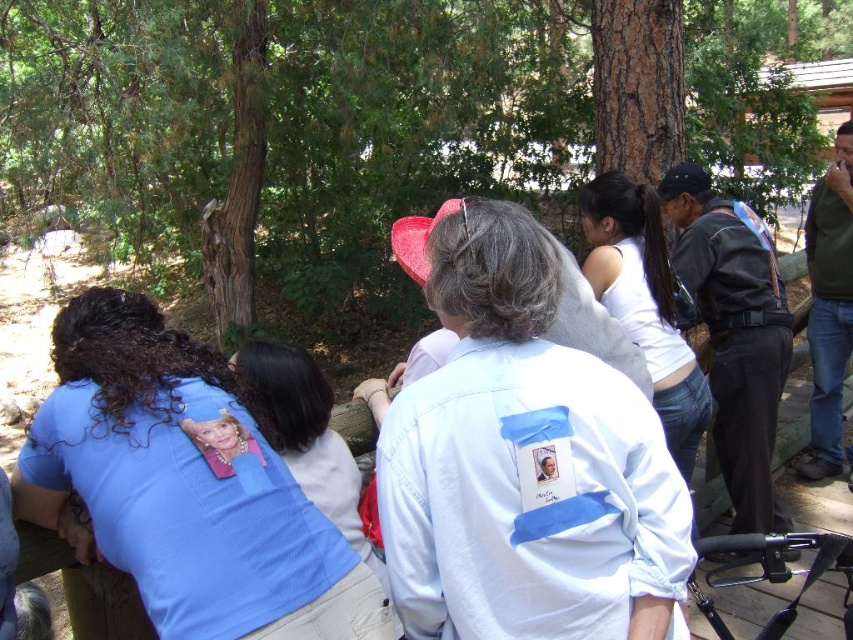
Question: From the image, what is the correct spatial relationship of brown rough tree at center in relation to white cotton tank top at upper right?

Choices:
 (A) left
 (B) right

Answer: (B)

Question: Can you confirm if blue mesh shirt at lower left is bigger than white cotton tank top at upper right?

Choices:
 (A) no
 (B) yes

Answer: (B)

Question: Estimate the real-world distances between objects in this image. Which object is farther from the blue mesh shirt at lower left?

Choices:
 (A) white cotton tank top at upper right
 (B) brown rough tree at center

Answer: (B)

Question: Which point is farther to the camera?

Choices:
 (A) white cotton tank top at upper right
 (B) blue mesh shirt at lower left

Answer: (A)

Question: Is blue mesh shirt at lower left to the right of blue mesh shirt at center from the viewer's perspective?

Choices:
 (A) no
 (B) yes

Answer: (A)

Question: Which point is farther to the camera?

Choices:
 (A) blue mesh shirt at center
 (B) white cotton tank top at upper right
 (C) brown rough tree at center

Answer: (C)